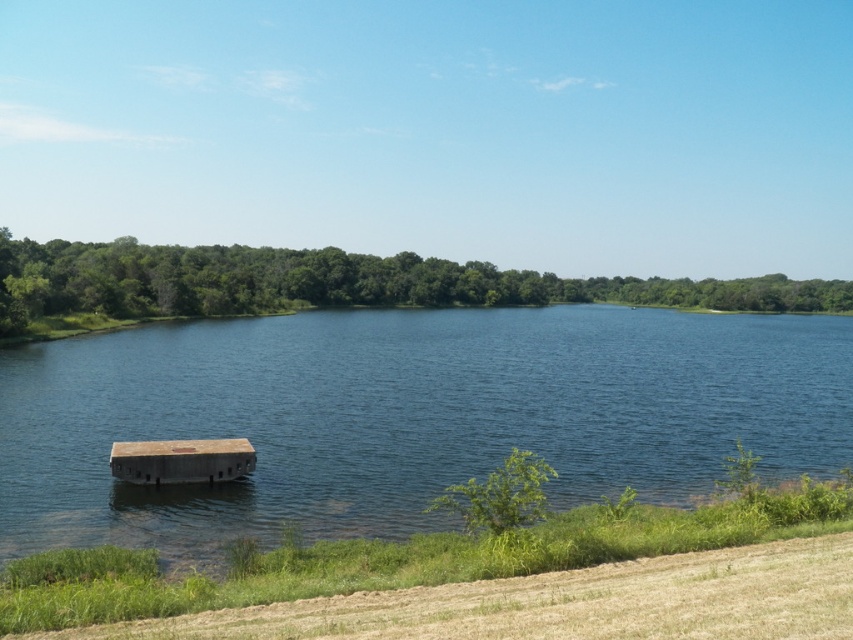
Is point (340, 406) closer to viewer compared to point (114, 444)?

No, it is behind (114, 444).

Where is `clear blue water at center`? clear blue water at center is located at coordinates (407, 417).

This screenshot has width=853, height=640. Find the location of `clear blue water at center`. clear blue water at center is located at coordinates (407, 417).